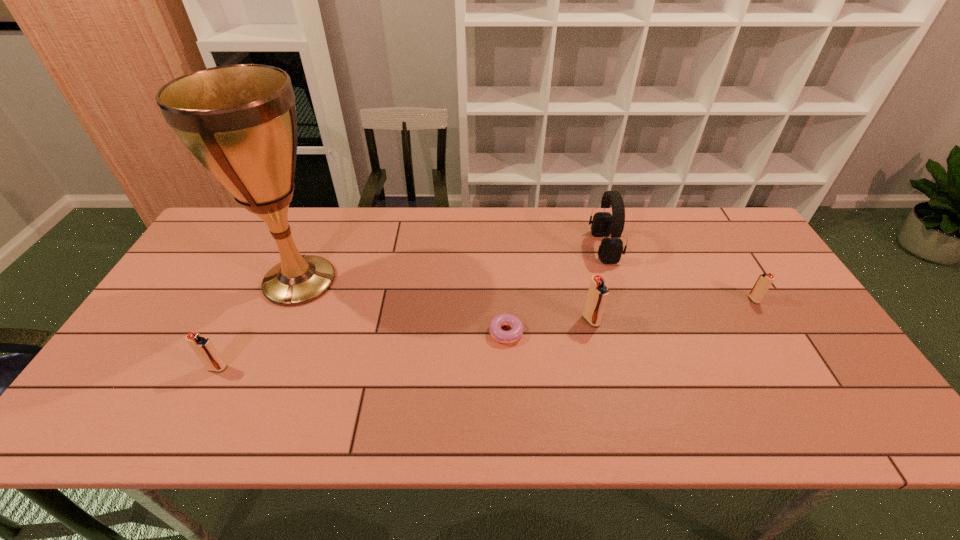
The image size is (960, 540). In order to click on the tallest object in this screenshot , I will do `click(239, 121)`.

Locate an element on the screen. The height and width of the screenshot is (540, 960). free location located 0.100m on the left of the nearest object is located at coordinates (166, 368).

I want to click on vacant space positioned on the back of the tallest igniter, so pos(582,279).

In order to click on free spot located 0.160m on the left of the second shortest object in this screenshot , I will do `click(692, 300)`.

The width and height of the screenshot is (960, 540). Find the location of `free space located 0.080m on the headband of the fifth shortest object`. free space located 0.080m on the headband of the fifth shortest object is located at coordinates (565, 247).

At what (x,y) coordinates should I click in order to perform the action: click on free space located on the headband of the fifth shortest object. Please return your answer as a coordinate pair (x, y). Image resolution: width=960 pixels, height=540 pixels. Looking at the image, I should click on (484, 247).

The height and width of the screenshot is (540, 960). I want to click on blank space located on the headband of the fifth shortest object, so click(x=575, y=247).

The width and height of the screenshot is (960, 540). Find the location of `blank area located on the right of the doughnut`. blank area located on the right of the doughnut is located at coordinates (565, 329).

Find the location of a particular element. This screenshot has width=960, height=540. vacant area located 0.080m on the left of the trophy cup is located at coordinates (228, 281).

Identify the location of headset that is at the far edge. Image resolution: width=960 pixels, height=540 pixels. (604, 224).